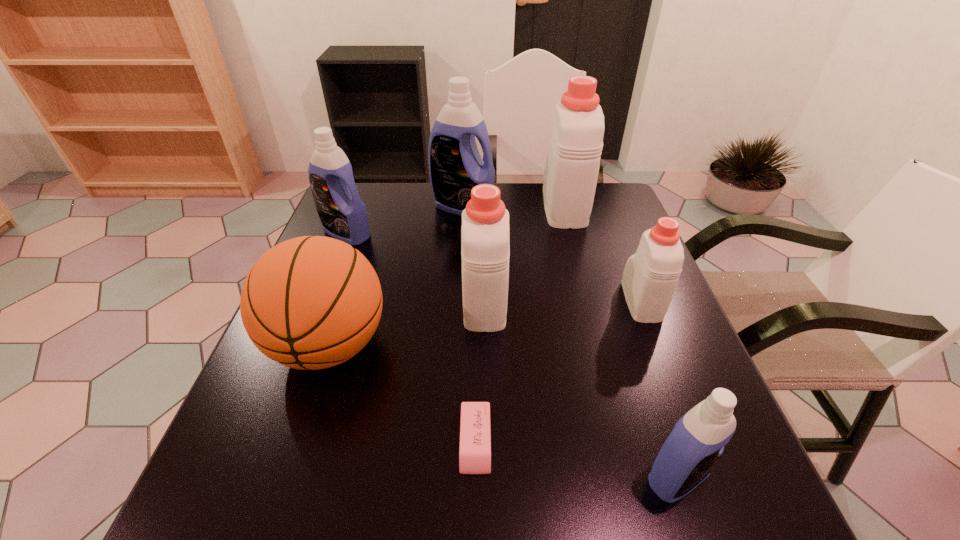
Image resolution: width=960 pixels, height=540 pixels. Find the location of `vacant area at the near edge of the desktop`. vacant area at the near edge of the desktop is located at coordinates (445, 532).

At what (x,y) coordinates should I click in order to perform the action: click on free space at the left edge. Please return your answer as a coordinate pair (x, y). This screenshot has width=960, height=540. Looking at the image, I should click on pos(241,446).

Locate an element on the screen. This screenshot has width=960, height=540. free space at the right edge is located at coordinates (593, 242).

Locate an element on the screen. The height and width of the screenshot is (540, 960). vacant space at the near left corner of the desktop is located at coordinates [x=222, y=515].

Identify the location of blank space at the far right corner of the desktop. The width and height of the screenshot is (960, 540). (609, 214).

I want to click on free region at the near right corner of the desktop, so click(747, 515).

Where is `vacant area between the smallest blue detergent and the basketball`? vacant area between the smallest blue detergent and the basketball is located at coordinates (503, 411).

This screenshot has width=960, height=540. In order to click on empty location between the second biggest white detergent and the shortest object in this screenshot , I will do `click(480, 372)`.

Find the location of a particular element. The image size is (960, 540). unoccupied area between the smallest white detergent and the biggest blue detergent is located at coordinates (552, 254).

At what (x,y) coordinates should I click in order to perform the action: click on vacant space that is in between the smallest white detergent and the leftmost white detergent. Please return your answer as a coordinate pair (x, y). This screenshot has height=540, width=960. Looking at the image, I should click on (563, 300).